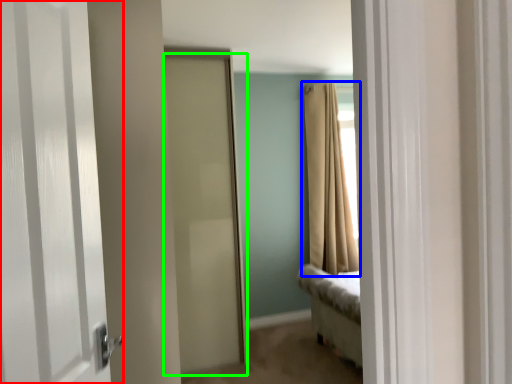
Question: Which is farther away from door (highlighted by a red box)? curtain (highlighted by a blue box) or door (highlighted by a green box)?

Choices:
 (A) curtain
 (B) door

Answer: (A)